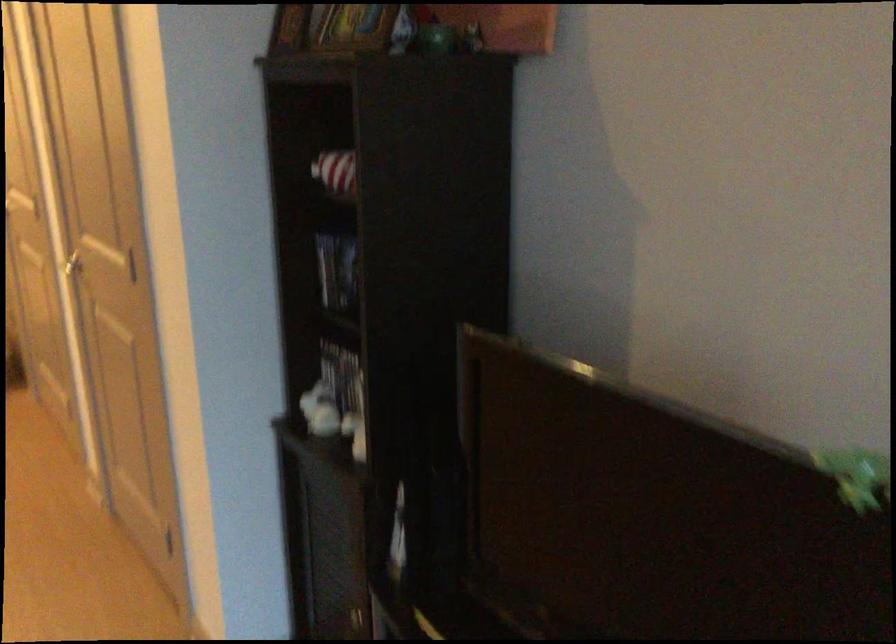
Locate an element on the screen. Image resolution: width=896 pixels, height=644 pixels. white figurine is located at coordinates (332, 418).